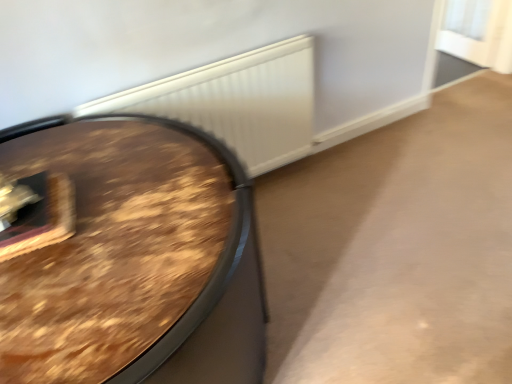
I want to click on free space in front of white textured radiator at center, so click(x=310, y=285).